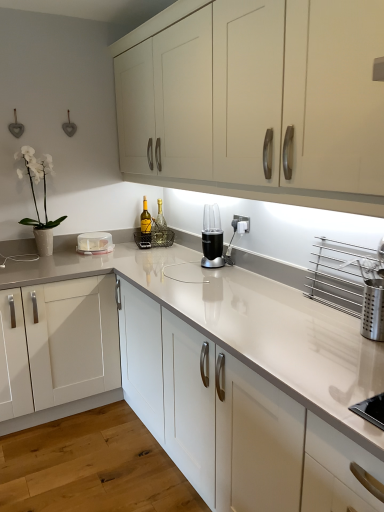
Question: In terms of size, does black plastic blender at center appear bigger or smaller than white glossy vase at upper left?

Choices:
 (A) big
 (B) small

Answer: (B)

Question: Is black plastic blender at center taller or shorter than white glossy vase at upper left?

Choices:
 (A) tall
 (B) short

Answer: (B)

Question: Estimate the real-world distances between objects in this image. Which object is farther from the clear glass bottle at center, arranged as the first bottle when viewed from the right?

Choices:
 (A) matte white cabinets at upper center
 (B) white glossy countertop at center
 (C) yellow glass bottle at center, the second bottle viewed from the right
 (D) clear plastic container at left
 (E) black plastic blender at center

Answer: (A)

Question: Considering the real-world distances, which object is farthest from the clear plastic container at left?

Choices:
 (A) white glossy countertop at center
 (B) white glossy vase at upper left
 (C) matte white cabinets at upper center
 (D) clear glass bottle at center, arranged as the first bottle when viewed from the right
 (E) yellow glass bottle at center, the 1th bottle in the left-to-right sequence

Answer: (C)